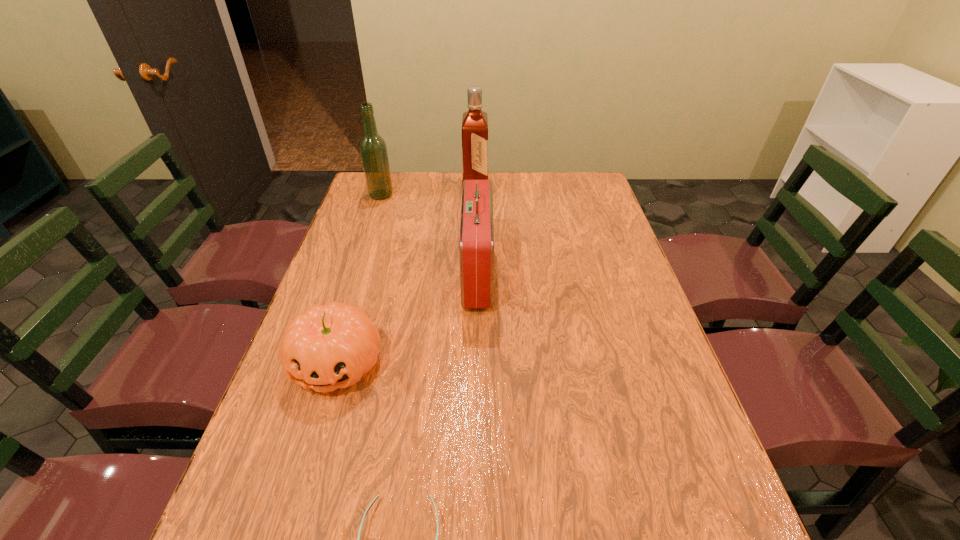
At what (x,y) coordinates should I click in order to perform the action: click on the right liquor. Please return your answer as a coordinate pair (x, y). Looking at the image, I should click on (475, 122).

Where is `the left liquor`? This screenshot has width=960, height=540. the left liquor is located at coordinates (373, 148).

Identify the location of the third tallest object. (476, 242).

Identify the location of the third nearest object. (476, 242).

Find the location of `the second shortest object`. the second shortest object is located at coordinates (331, 346).

At what (x,y) coordinates should I click in order to perform the action: click on the fourth farthest object. Please return your answer as a coordinate pair (x, y). Looking at the image, I should click on (331, 346).

Where is `free space located on the front label of the right liquor`? free space located on the front label of the right liquor is located at coordinates (525, 190).

Locate an element on the screen. free space located 0.110m on the front of the left liquor is located at coordinates (373, 218).

I want to click on vacant region located on the side of the third nearest object with the first aid cross symbol, so click(x=536, y=274).

You are a GUI agent. You are given a task and a screenshot of the screen. Output one action in this format:
    pyautogui.click(x=<x>, y=<y>)
    Task: Click on the free region located 0.120m on the carved face of the fourth tallest object
    
    Given the screenshot: What is the action you would take?
    pyautogui.click(x=308, y=455)